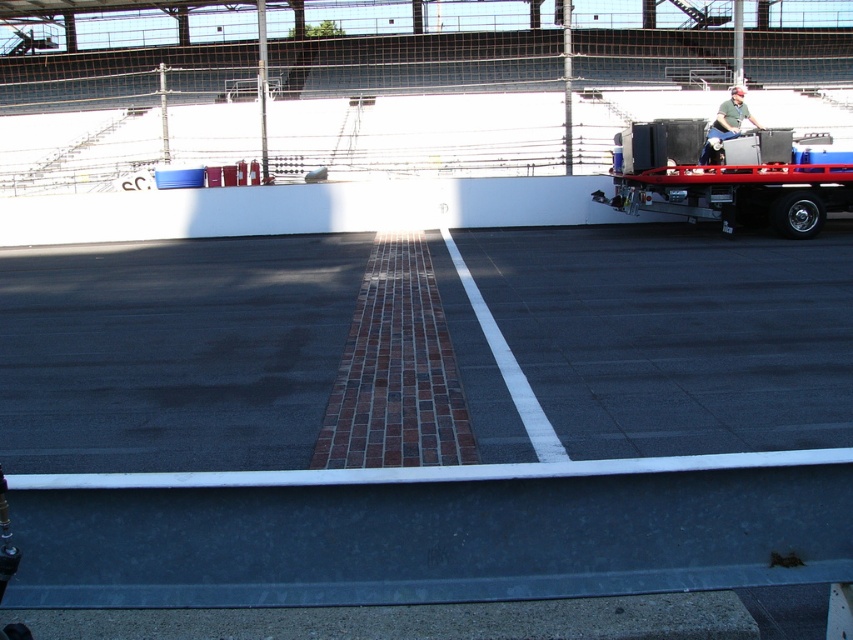
You are a photographer positioned at the center of the track. You need to capture a wide shot that includes both the metallic trailer at right and the green matte shirt at upper right. Given their sizes, which object will appear larger in the photo?

The metallic trailer at right will appear larger in the photo because its width is larger than that of the green matte shirt at upper right.

You are a photographer positioned at the edge of the track. You need to capture a photo that includes both the metallic trailer at right and the green matte shirt at upper right. Which object should you focus on first to ensure both are in sharp focus?

The metallic trailer at right is closer to the viewer than the green matte shirt at upper right. To ensure both are in sharp focus, you should focus on the metallic trailer at right first, as it is closer, and the depth of field will naturally include the farther object in acceptable focus.

You are standing at the center of the track and want to move towards the metallic trailer at right. Which direction should you go?

The metallic trailer at right is located at point (733, 179), so you should move towards the right side of the track to reach it.